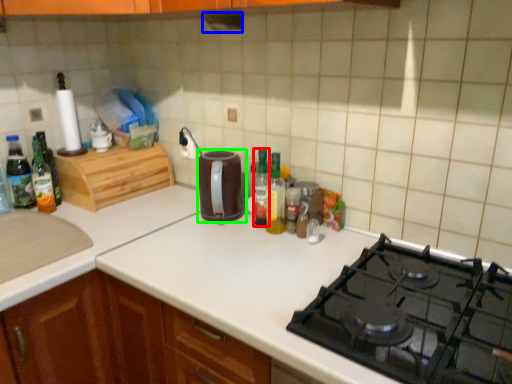
Question: Estimate the real-world distances between objects in this image. Which object is closer to bottle (highlighted by a red box), exhaust hood (highlighted by a blue box) or kitchen appliance (highlighted by a green box)?

Choices:
 (A) exhaust hood
 (B) kitchen appliance

Answer: (B)